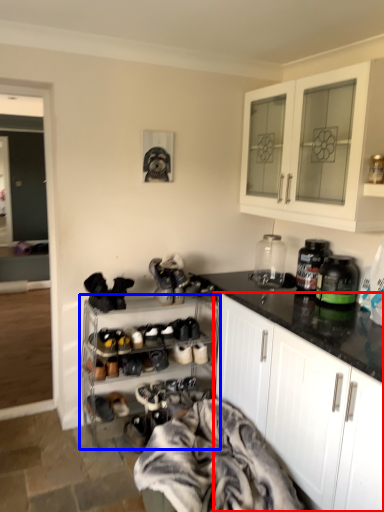
Question: Among these objects, which one is farthest to the camera, cabinetry (highlighted by a red box) or shelf (highlighted by a blue box)?

Choices:
 (A) cabinetry
 (B) shelf

Answer: (B)